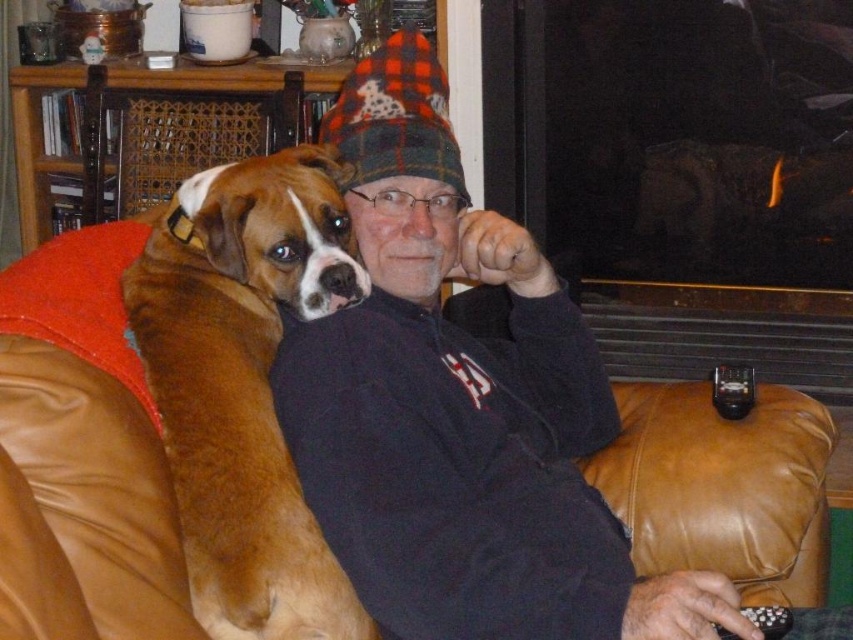
I want to click on dark blue fleece jacket at center, so click(460, 408).

Who is more forward, (x=433, y=328) or (x=80, y=625)?

Point (x=80, y=625) is more forward.

Which is behind, point (367, 412) or point (143, 580)?

Point (367, 412)

You are a GUI agent. You are given a task and a screenshot of the screen. Output one action in this format:
    pyautogui.click(x=<x>, y=<y>)
    Task: Click on the dark blue fleece jacket at center
    The width and height of the screenshot is (853, 640).
    Given the screenshot: What is the action you would take?
    pyautogui.click(x=460, y=408)

Does brown leather couch at center appear over brown leather chair at upper left?

Incorrect, brown leather couch at center is not positioned above brown leather chair at upper left.

Does point (154, 595) lie in front of point (152, 120)?

Yes, point (154, 595) is in front of point (152, 120).

Identify the location of brown leather couch at center. (80, 454).

Where is `brown leather couch at center`? The height and width of the screenshot is (640, 853). brown leather couch at center is located at coordinates (80, 454).

Which of these two, dark blue fleece jacket at center or brown leather chair at upper left, stands taller?

dark blue fleece jacket at center

Which is more to the left, dark blue fleece jacket at center or brown leather chair at upper left?

From the viewer's perspective, brown leather chair at upper left appears more on the left side.

Is point (318, 330) more distant than point (155, 132)?

No, (318, 330) is closer to viewer.

Locate an element on the screen. The width and height of the screenshot is (853, 640). dark blue fleece jacket at center is located at coordinates (460, 408).